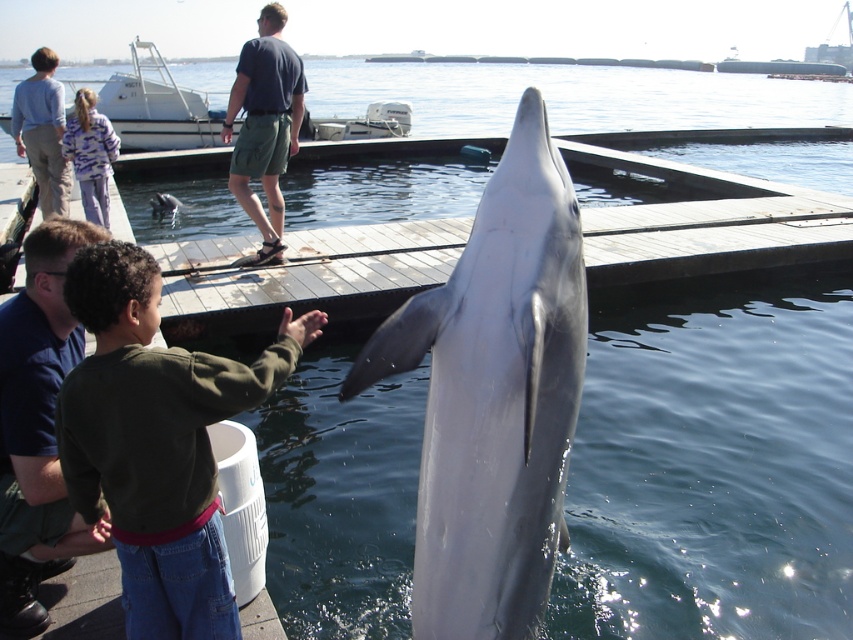
Can you confirm if silvery smooth dolphin at center is shorter than dark blue cotton shirt at upper center?

Yes.

Is silvery smooth dolphin at center below dark blue cotton shirt at upper center?

Yes, silvery smooth dolphin at center is below dark blue cotton shirt at upper center.

This screenshot has width=853, height=640. What do you see at coordinates (494, 396) in the screenshot?
I see `silvery smooth dolphin at center` at bounding box center [494, 396].

The image size is (853, 640). I want to click on silvery smooth dolphin at center, so click(494, 396).

Is green cotton shirt at lower left behind blue shirt at upper left?

No, it is not.

Who is positioned more to the right, green cotton shirt at lower left or blue shirt at upper left?

green cotton shirt at lower left is more to the right.

Measure the distance between green cotton shirt at lower left and camera.

green cotton shirt at lower left and camera are 2.06 meters apart.

Image resolution: width=853 pixels, height=640 pixels. I want to click on green cotton shirt at lower left, so click(155, 442).

Does blue shirt at upper left appear on the right side of dark blue cotton shirt at upper center?

Correct, you'll find blue shirt at upper left to the right of dark blue cotton shirt at upper center.

Who is lower down, blue shirt at upper left or dark blue cotton shirt at upper center?

blue shirt at upper left is lower down.

I want to click on blue shirt at upper left, so click(x=38, y=426).

Find the location of a particular element. blue shirt at upper left is located at coordinates (38, 426).